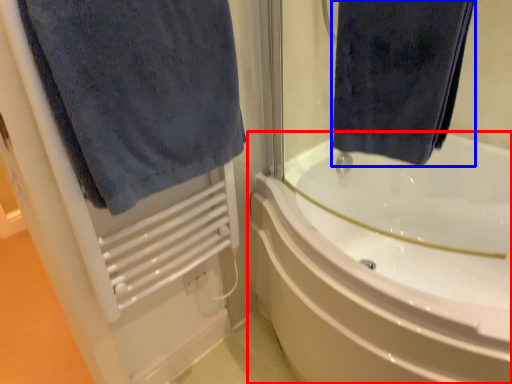
Question: Among these objects, which one is farthest to the camera, bathtub (highlighted by a red box) or towel (highlighted by a blue box)?

Choices:
 (A) bathtub
 (B) towel

Answer: (A)